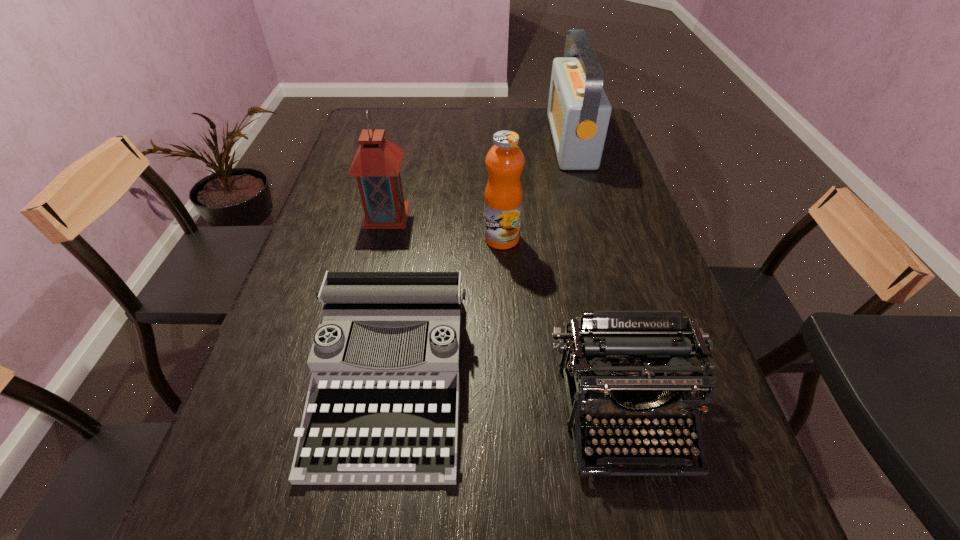
The width and height of the screenshot is (960, 540). Find the location of `vacant point located 0.240m on the right of the lantern`. vacant point located 0.240m on the right of the lantern is located at coordinates (493, 215).

You are a GUI agent. You are given a task and a screenshot of the screen. Output one action in this format:
    pyautogui.click(x=<x>, y=<y>)
    Task: Click on the vacant region located 0.350m on the right of the fruit juice
    Image resolution: width=960 pixels, height=540 pixels.
    Given the screenshot: What is the action you would take?
    point(651,239)

Identify the location of vacant space situated 0.080m on the typing side of the right typewriter. This screenshot has height=540, width=960. (653, 534).

Locate an element on the screen. The height and width of the screenshot is (540, 960). vacant area situated on the typing side of the left typewriter is located at coordinates (369, 517).

I want to click on object that is at the far edge, so click(579, 111).

Locate an element on the screen. lantern located at the left edge is located at coordinates (376, 164).

Locate an element on the screen. typewriter that is at the left edge is located at coordinates (382, 408).

Locate an element on the screen. radio receiver positioned at the right edge is located at coordinates (579, 111).

You are a GUI agent. You are given a task and a screenshot of the screen. Output one action in this format:
    pyautogui.click(x=<x>, y=<y>)
    Task: Click on the typewriter located in the right edge section of the desktop
    The width and height of the screenshot is (960, 540).
    Given the screenshot: What is the action you would take?
    pyautogui.click(x=618, y=358)

Identify the location of object at the far right corner. This screenshot has height=540, width=960. (579, 111).